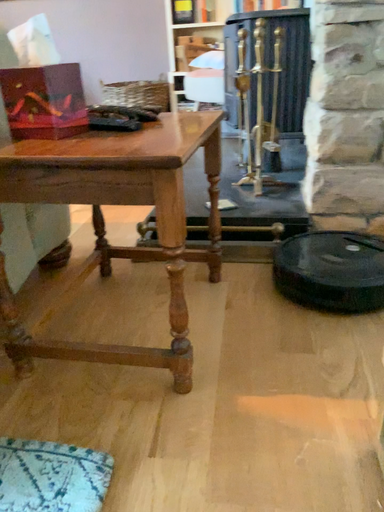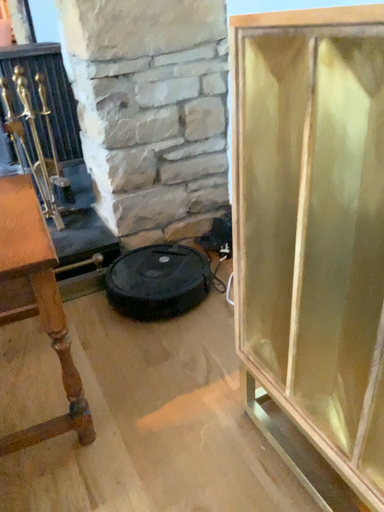
Question: How did the camera likely rotate when shooting the video?

Choices:
 (A) rotated right
 (B) rotated left

Answer: (A)